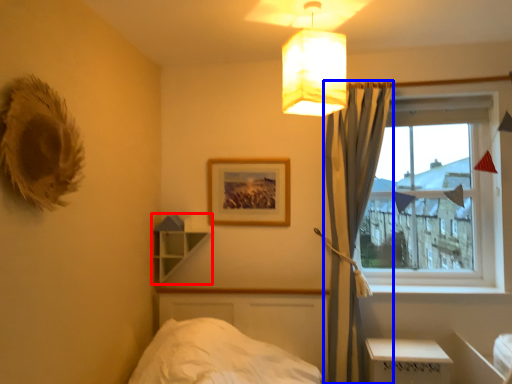
Question: Which object appears closest to the camera in this image, shelf (highlighted by a red box) or curtain (highlighted by a blue box)?

Choices:
 (A) shelf
 (B) curtain

Answer: (B)